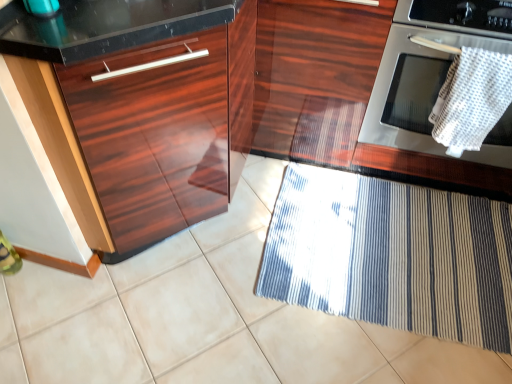
Question: Can you confirm if blue striped mat at lower right is shorter than white woven towel at upper right?

Choices:
 (A) yes
 (B) no

Answer: (A)

Question: Considering the relative sizes of blue striped mat at lower right and white woven towel at upper right in the image provided, is blue striped mat at lower right smaller than white woven towel at upper right?

Choices:
 (A) yes
 (B) no

Answer: (B)

Question: Is blue striped mat at lower right further to the viewer compared to white woven towel at upper right?

Choices:
 (A) no
 (B) yes

Answer: (B)

Question: Can we say blue striped mat at lower right lies outside white woven towel at upper right?

Choices:
 (A) no
 (B) yes

Answer: (B)

Question: Is blue striped mat at lower right oriented away from white woven towel at upper right?

Choices:
 (A) no
 (B) yes

Answer: (A)

Question: In terms of width, does glossy wood cabinet at center, placed as the 2th cabinetry when sorted from right to left, look wider or thinner when compared to stainless steel oven at right?

Choices:
 (A) wide
 (B) thin

Answer: (A)

Question: Is glossy wood cabinet at center, marked as the first cabinetry in a left-to-right arrangement, bigger or smaller than stainless steel oven at right?

Choices:
 (A) small
 (B) big

Answer: (B)

Question: Is glossy wood cabinet at center, placed as the 2th cabinetry when sorted from right to left, taller or shorter than stainless steel oven at right?

Choices:
 (A) tall
 (B) short

Answer: (A)

Question: Visually, is glossy wood cabinet at center, marked as the first cabinetry in a left-to-right arrangement, positioned to the left or to the right of stainless steel oven at right?

Choices:
 (A) right
 (B) left

Answer: (B)

Question: In terms of height, does stainless steel oven at right look taller or shorter compared to glossy wood drawer at left?

Choices:
 (A) tall
 (B) short

Answer: (B)

Question: From the image's perspective, relative to glossy wood drawer at left, is stainless steel oven at right above or below?

Choices:
 (A) below
 (B) above

Answer: (B)

Question: From a real-world perspective, is stainless steel oven at right above or below glossy wood drawer at left?

Choices:
 (A) below
 (B) above

Answer: (A)

Question: Based on their positions, is stainless steel oven at right located to the left or right of glossy wood drawer at left?

Choices:
 (A) right
 (B) left

Answer: (A)

Question: Is glossy wood cabinet at center, marked as the first cabinetry in a left-to-right arrangement, inside the boundaries of glossy wood cabinet at center, placed as the 2th cabinetry when sorted from left to right, or outside?

Choices:
 (A) outside
 (B) inside

Answer: (B)

Question: Considering the positions of glossy wood cabinet at center, marked as the first cabinetry in a left-to-right arrangement, and glossy wood cabinet at center, placed as the 2th cabinetry when sorted from left to right, in the image, is glossy wood cabinet at center, marked as the first cabinetry in a left-to-right arrangement, taller or shorter than glossy wood cabinet at center, placed as the 2th cabinetry when sorted from left to right,?

Choices:
 (A) tall
 (B) short

Answer: (A)